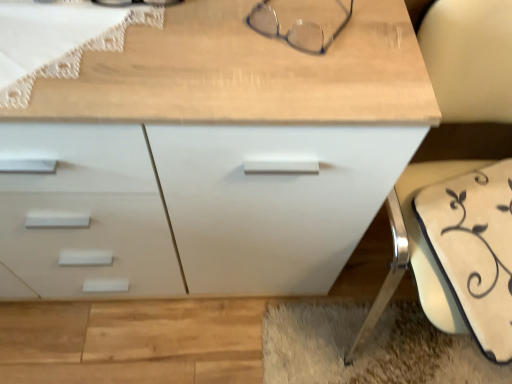
Locate an element on the screen. Image resolution: width=512 pixels, height=384 pixels. blank space above white matte chest of drawers at center (from a real-world perspective) is located at coordinates (176, 46).